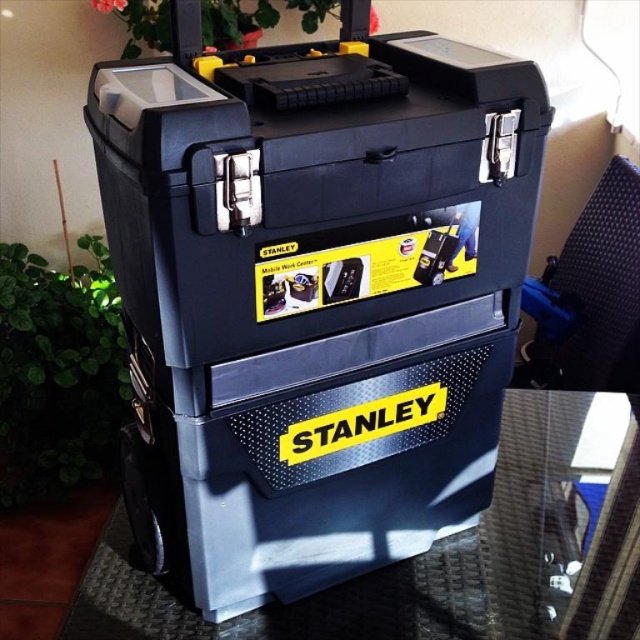
Which is more to the left, matte black toolbox at center or transparent glass table at lower right?

Positioned to the left is matte black toolbox at center.

Is matte black toolbox at center taller than transparent glass table at lower right?

Yes.

The height and width of the screenshot is (640, 640). I want to click on matte black toolbox at center, so click(x=314, y=296).